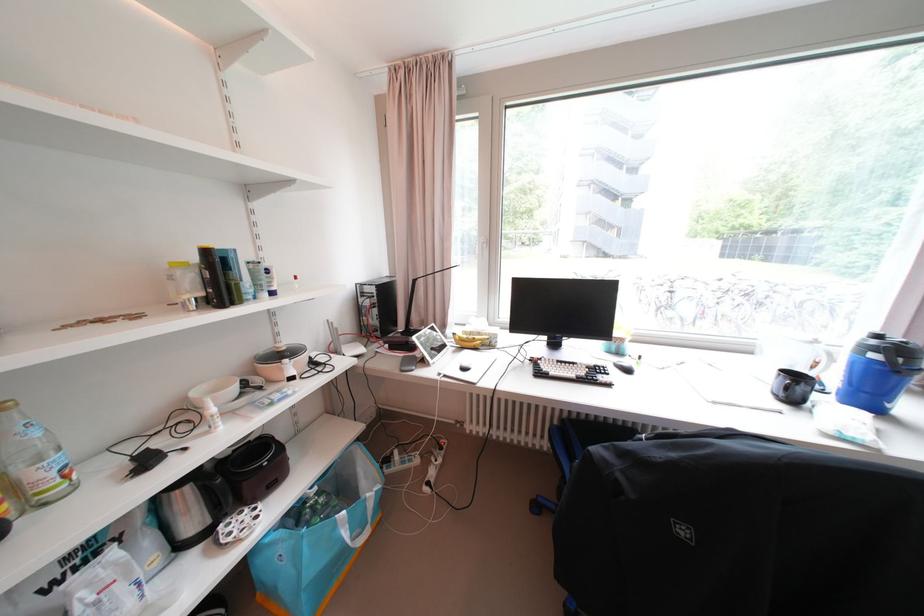
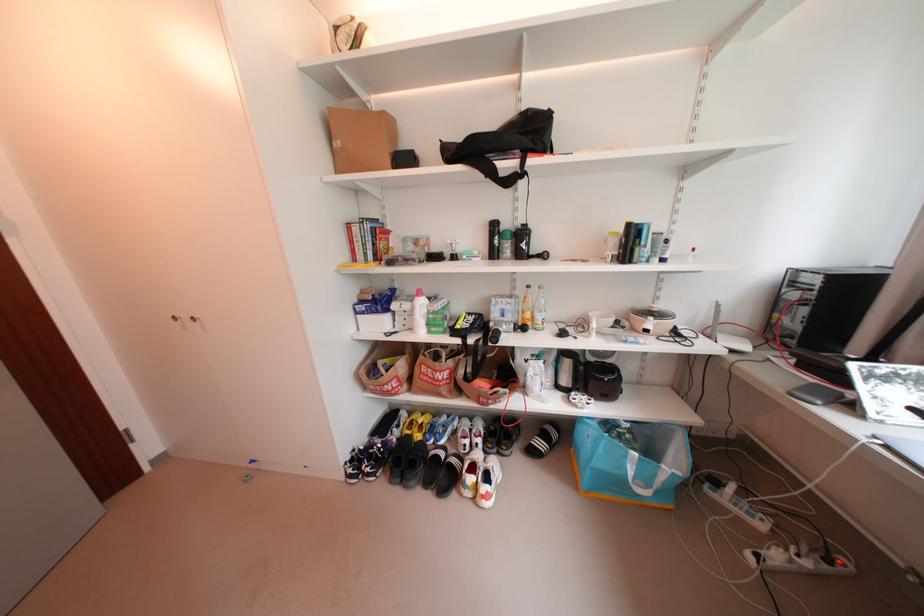
Locate, in the second image, the point that corresponds to pixel 299 379 in the first image.

(655, 331)